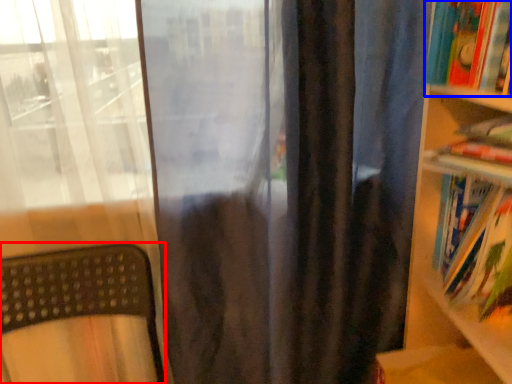
Question: Which object appears farthest to the camera in this image, furniture (highlighted by a red box) or book (highlighted by a blue box)?

Choices:
 (A) furniture
 (B) book

Answer: (B)